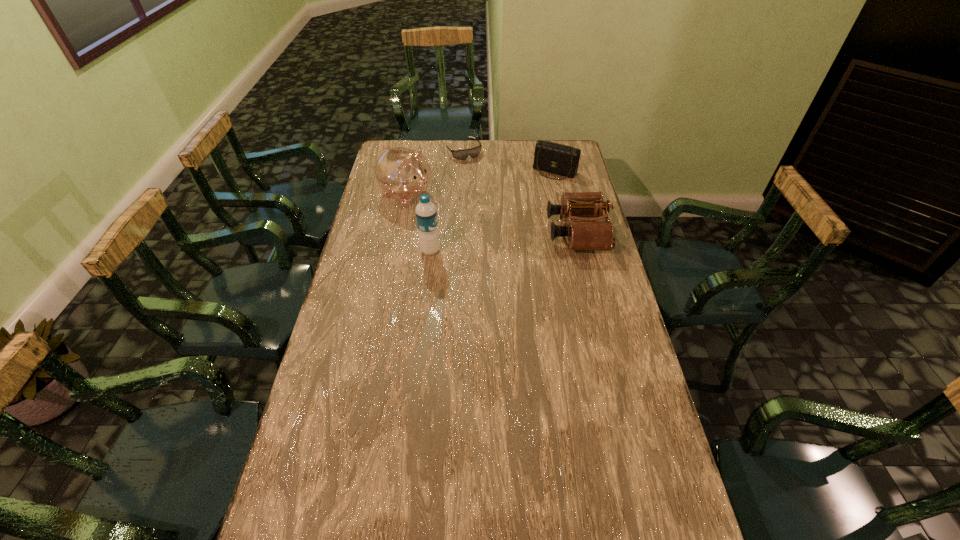
Identify the location of water bottle. (426, 214).

Image resolution: width=960 pixels, height=540 pixels. I want to click on binoculars, so click(x=588, y=234).

Image resolution: width=960 pixels, height=540 pixels. I want to click on the fourth tallest object, so click(551, 157).

What are the coordinates of `piggy bank` in the screenshot? It's located at (402, 173).

I want to click on the farthest object, so click(x=473, y=152).

Find the location of a particular element. goggles is located at coordinates (473, 152).

Identify the location of free space located on the label of the water bottle. The width and height of the screenshot is (960, 540). (473, 251).

This screenshot has width=960, height=540. What are the coordinates of `vacant point located through the eyepieces of the third tallest object` in the screenshot? It's located at (536, 233).

Find the location of a particular element. The height and width of the screenshot is (540, 960). free region located 0.230m through the eyepieces of the third tallest object is located at coordinates (488, 233).

Find the location of a particular element. This screenshot has height=540, width=960. vacant region located through the eyepieces of the third tallest object is located at coordinates (483, 233).